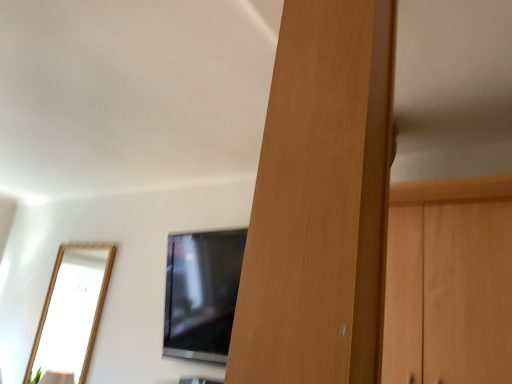
Question: Can you confirm if black glossy tv at center is shorter than wooden door at center?

Choices:
 (A) yes
 (B) no

Answer: (A)

Question: From a real-world perspective, is black glossy tv at center on wooden door at center?

Choices:
 (A) yes
 (B) no

Answer: (B)

Question: Considering the relative sizes of black glossy tv at center and wooden door at center in the image provided, is black glossy tv at center taller than wooden door at center?

Choices:
 (A) yes
 (B) no

Answer: (B)

Question: Is black glossy tv at center positioned behind wooden door at center?

Choices:
 (A) no
 (B) yes

Answer: (B)

Question: Does black glossy tv at center have a lesser width compared to wooden door at center?

Choices:
 (A) yes
 (B) no

Answer: (B)

Question: Is the position of black glossy tv at center less distant than that of wooden door at center?

Choices:
 (A) yes
 (B) no

Answer: (B)

Question: Can you confirm if wooden door at center is shorter than black glossy tv at center?

Choices:
 (A) yes
 (B) no

Answer: (B)

Question: Is wooden door at center far from black glossy tv at center?

Choices:
 (A) yes
 (B) no

Answer: (A)

Question: Is wooden door at center outside black glossy tv at center?

Choices:
 (A) no
 (B) yes

Answer: (B)

Question: Can you confirm if wooden door at center is smaller than black glossy tv at center?

Choices:
 (A) no
 (B) yes

Answer: (B)

Question: Does wooden door at center have a greater width compared to black glossy tv at center?

Choices:
 (A) no
 (B) yes

Answer: (A)

Question: From the image's perspective, is wooden door at center beneath black glossy tv at center?

Choices:
 (A) yes
 (B) no

Answer: (B)

Question: In the image, is wooden door at center on the left side or the right side of black glossy tv at center?

Choices:
 (A) left
 (B) right

Answer: (B)